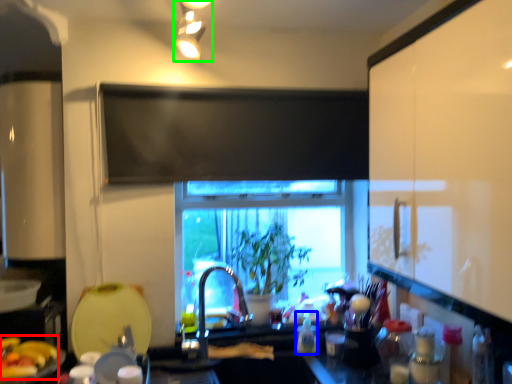
Question: Estimate the real-world distances between objects in this image. Which object is farther from food (highlighted by a red box), bottle (highlighted by a blue box) or light fixture (highlighted by a green box)?

Choices:
 (A) bottle
 (B) light fixture

Answer: (B)